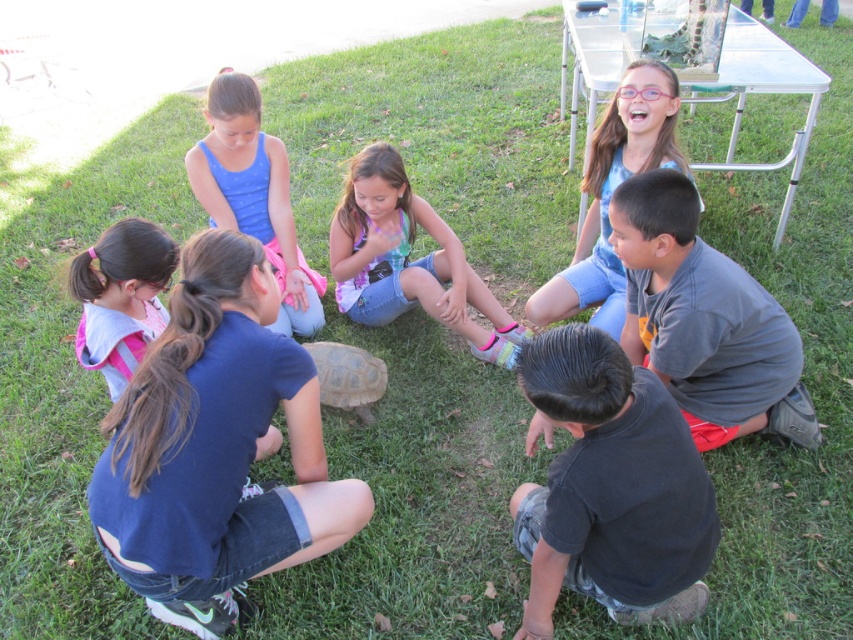
Question: Can you confirm if blue fabric shirt at upper left is thinner than pink denim shorts at upper center?

Choices:
 (A) no
 (B) yes

Answer: (A)

Question: Can you confirm if black cotton shirt at lower right is positioned to the right of pink fabric backpack at lower left?

Choices:
 (A) yes
 (B) no

Answer: (A)

Question: Among these objects, which one is nearest to the camera?

Choices:
 (A) brown rough textured turtle at center
 (B) denim shorts at lower left
 (C) blue fabric shirt at upper left
 (D) black cotton shirt at lower right

Answer: (D)

Question: From the image, what is the correct spatial relationship of black cotton shirt at lower right in relation to blue fabric shirt at upper left?

Choices:
 (A) right
 (B) left

Answer: (A)

Question: Based on their relative distances, which object is farther from the denim shorts at lower left?

Choices:
 (A) pink denim shorts at center
 (B) pink fabric backpack at lower left
 (C) blue fabric shirt at upper left

Answer: (A)

Question: Which of the following is the farthest from the observer?

Choices:
 (A) (170, 560)
 (B) (410, 262)
 (C) (520, 492)

Answer: (B)